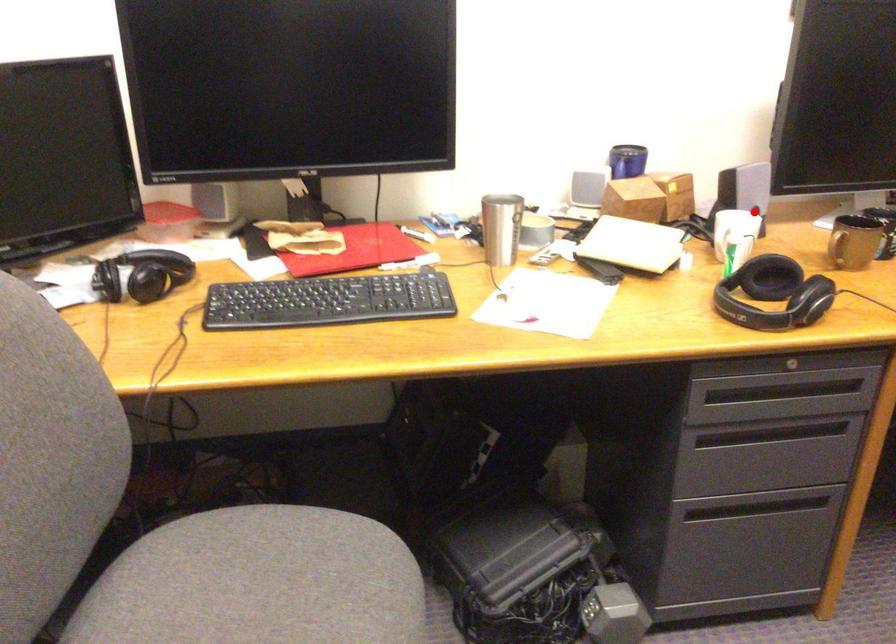
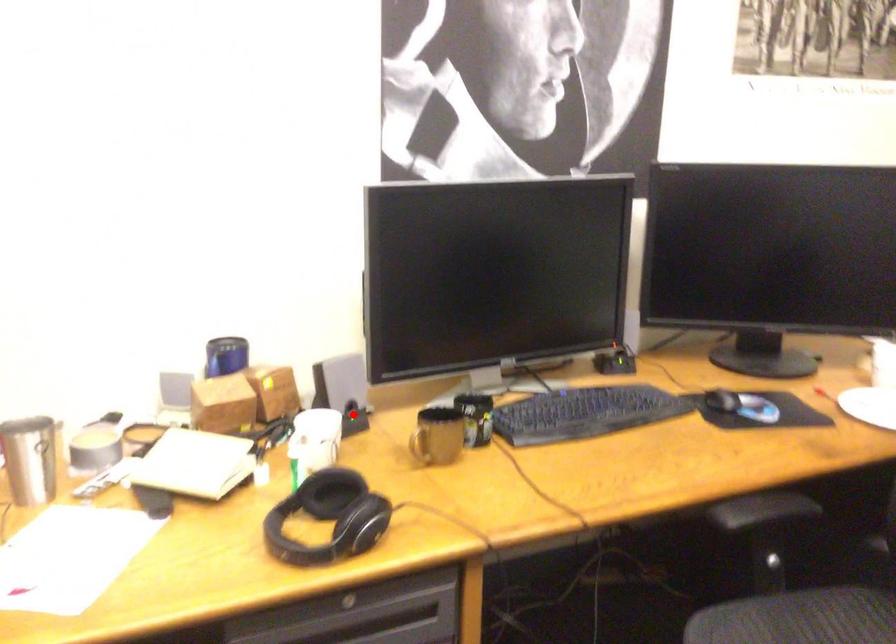
I am providing you with two images of the same scene from different viewpoints. A red point is marked on the first image and another point is marked on the second image. Does the point marked in image1 correspond to the same location as the one in image2?

Yes